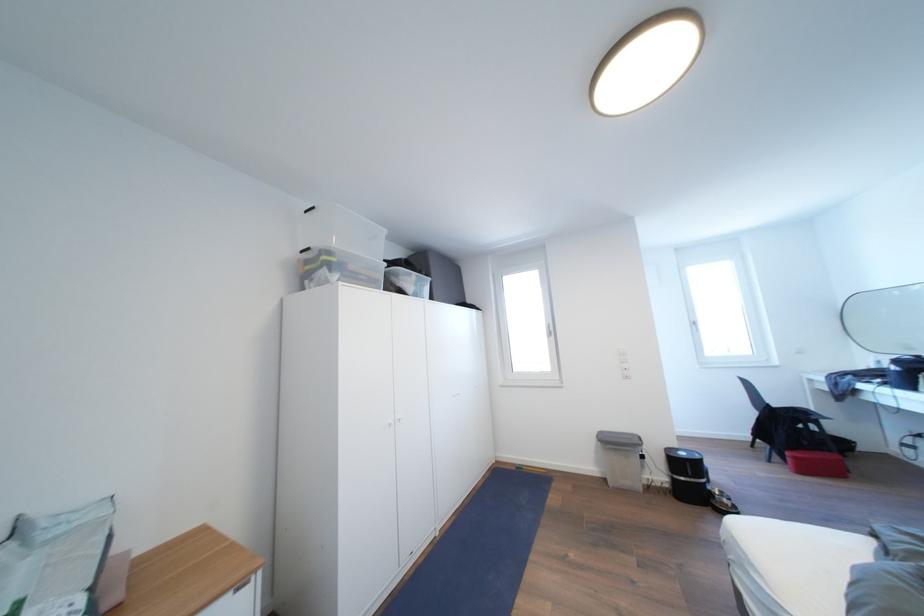
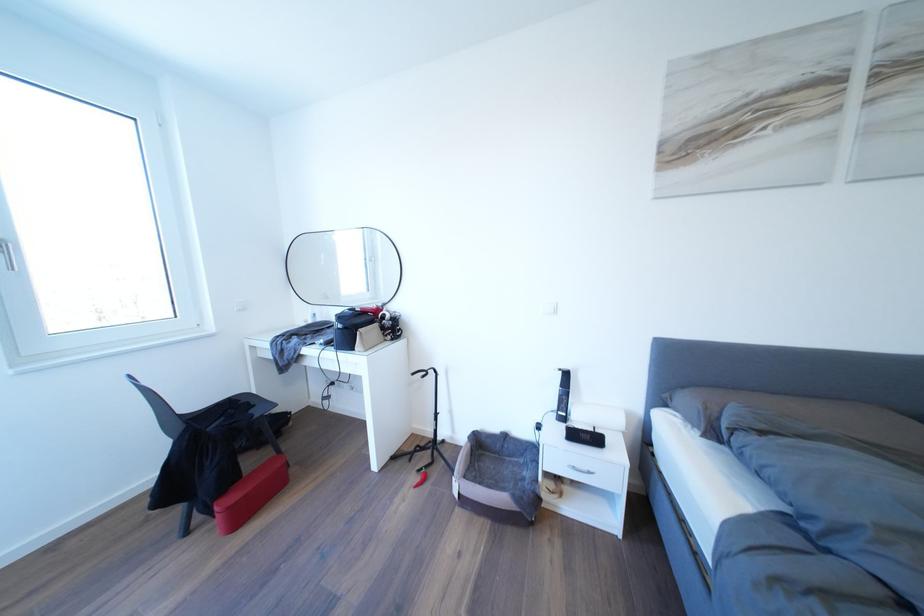
Locate, in the second image, the point that corresponds to point 791,462 in the first image.

(217, 519)